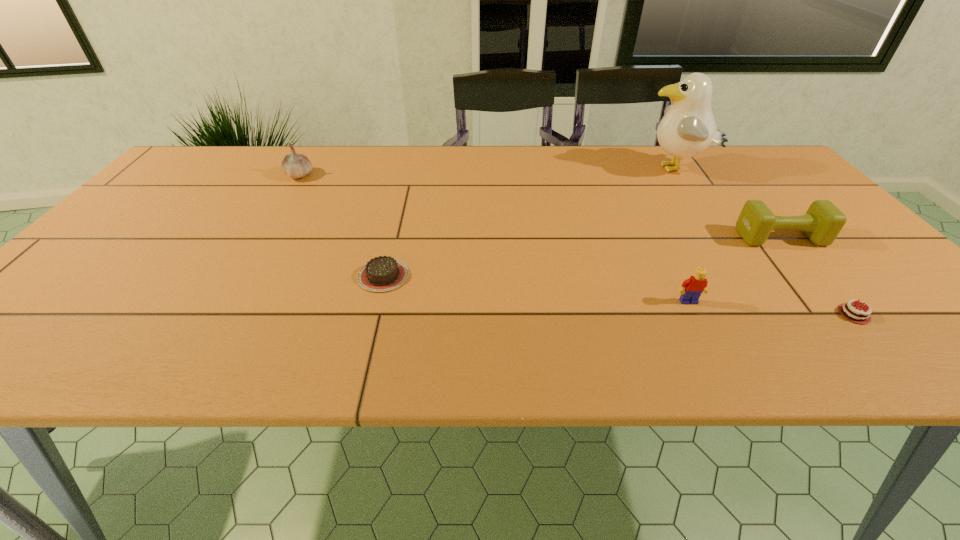
I want to click on vacant region at the far edge of the desktop, so click(x=262, y=154).

Identify the location of free space at the near edge. The height and width of the screenshot is (540, 960). (867, 348).

In the image, there is a desktop. Identify the location of vacant space at the left edge. The width and height of the screenshot is (960, 540). (104, 295).

In the image, there is a desktop. Where is `free space at the far right corner`? free space at the far right corner is located at coordinates (762, 159).

Where is `vacant area between the leftmost object and the dumbbell`? This screenshot has width=960, height=540. vacant area between the leftmost object and the dumbbell is located at coordinates (540, 206).

This screenshot has width=960, height=540. I want to click on free space that is in between the tallest object and the second object from left to right, so click(x=529, y=222).

You are a GUI agent. You are given a task and a screenshot of the screen. Output one action in this format:
    pyautogui.click(x=<x>, y=<y>)
    Task: Click on the free spot between the left chocolate cake and the Lego
    
    Given the screenshot: What is the action you would take?
    click(536, 288)

Where is `vacant space that's between the Lego and the garlic`? vacant space that's between the Lego and the garlic is located at coordinates (494, 238).

The height and width of the screenshot is (540, 960). What are the coordinates of `empty space that is in between the gull and the fourth object from right to left` in the screenshot? It's located at click(682, 235).

Where is `vacant space in between the second object from left to right and the garlic`? vacant space in between the second object from left to right and the garlic is located at coordinates (342, 225).